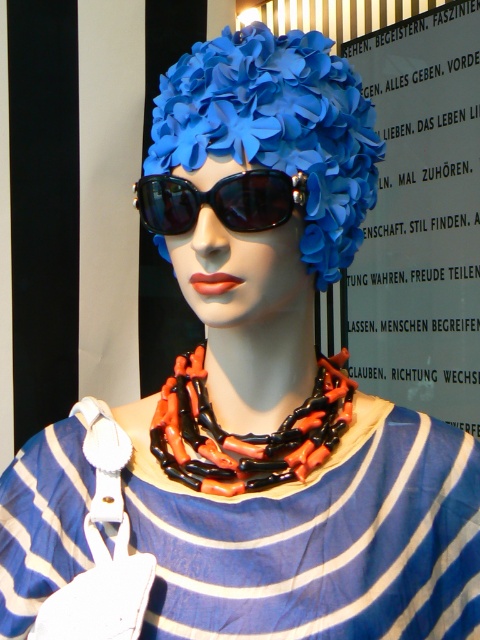
You are a fashion designer looking at the mannequin. You need to place a new accessory between the blue striped fabric dress at center and the black glossy sunglasses at center. Which side of the dress should you place it to ensure it is between them?

The blue striped fabric dress at center is positioned on the right side of black glossy sunglasses at center. To place the accessory between them, you should position it to the left of the blue striped fabric dress at center, between the dress and the sunglasses.

You are a fashion designer who wants to place a new accessory on the mannequin. The accessory requires a space larger than the black glossy sunglasses at center. Can the blue striped fabric dress at center provide enough space for this accessory?

The blue striped fabric dress at center is larger in size than the black glossy sunglasses at center, so yes, the dress can provide enough space for the accessory that requires a larger area than the sunglasses.

You are a fashion designer observing the mannequin. You need to adjust the placement of the blue striped fabric dress at center and the matte plastic flowers at center so that the flowers are more prominent. Which object should you move and in which direction?

To make the matte plastic flowers at center more prominent, you should move the blue striped fabric dress at center backward since it is currently closer to the viewer, blocking the flowers.